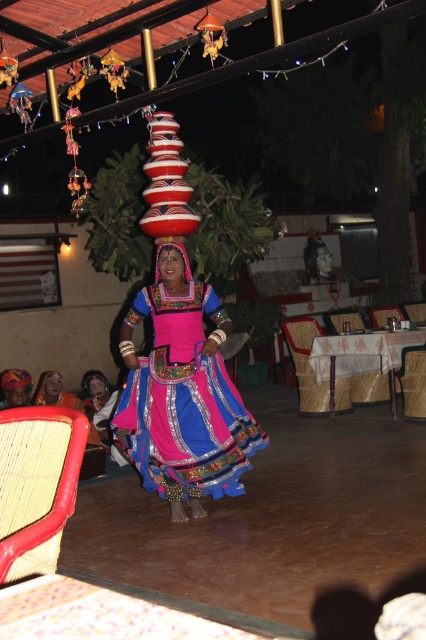
You are standing at the point labeled point (146, 467). The distance between you and the viewer is 15.75 feet. If you want to move closer to the viewer, which direction should you walk?

Since the point (146, 467) is 15.75 feet away from the viewer, you should walk towards the viewer to reduce the distance between you and them.

You are a photographer trying to capture the dancer in the scene. You notice the matte black head at center and the matte pink fabric headress at center. Which object has a greater width when viewed from your camera angle?

The matte black head at center has a greater width than the matte pink fabric headress at center.

You are an observer at the performance. You notice two items on the dancer wearing a bright pink and blue outfit. Which item is positioned lower on her head, the matte pink fabric head at center or the matte pink fabric headress at center?

The matte pink fabric head at center is positioned lower on her head than the matte pink fabric headress at center.